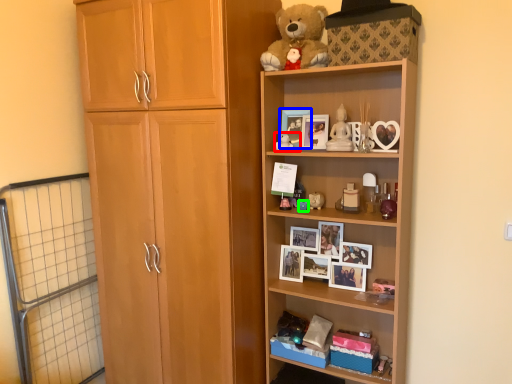
Question: Estimate the real-world distances between objects in this image. Which object is closer to toy (highlighted by a red box), picture frame (highlighted by a blue box) or toy (highlighted by a green box)?

Choices:
 (A) picture frame
 (B) toy

Answer: (A)